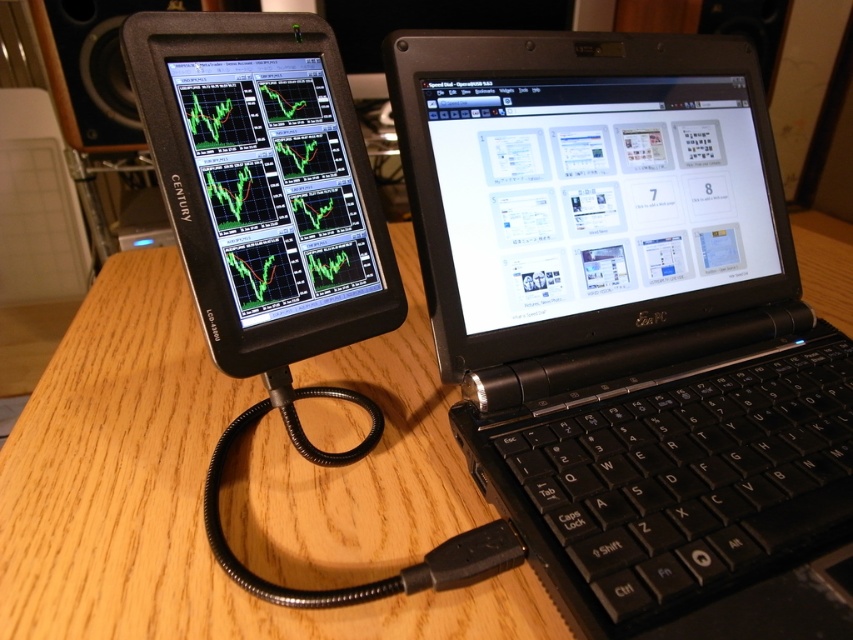
Question: Can you confirm if matte black screen at center is positioned below matte black screen at left?

Choices:
 (A) no
 (B) yes

Answer: (A)

Question: Among these points, which one is nearest to the camera?

Choices:
 (A) (585, 144)
 (B) (102, 579)
 (C) (589, 115)
 (D) (306, 118)

Answer: (B)

Question: Which point is closer to the camera?

Choices:
 (A) wooden table at center
 (B) matte black screen at center
 (C) black plastic keyboard at center

Answer: (C)

Question: Which of the following is the farthest from the observer?

Choices:
 (A) (444, 189)
 (B) (738, 500)

Answer: (A)

Question: Is black plastic laptop at center behind wooden table at center?

Choices:
 (A) yes
 (B) no

Answer: (B)

Question: Does black plastic laptop at center appear on the left side of matte black screen at center?

Choices:
 (A) yes
 (B) no

Answer: (A)